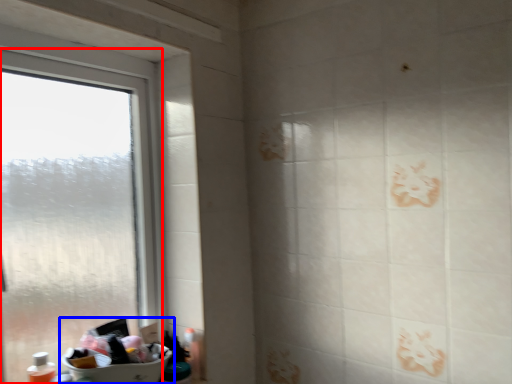
Question: Which point is further to the camera, window (highlighted by a red box) or sink (highlighted by a blue box)?

Choices:
 (A) window
 (B) sink

Answer: (B)